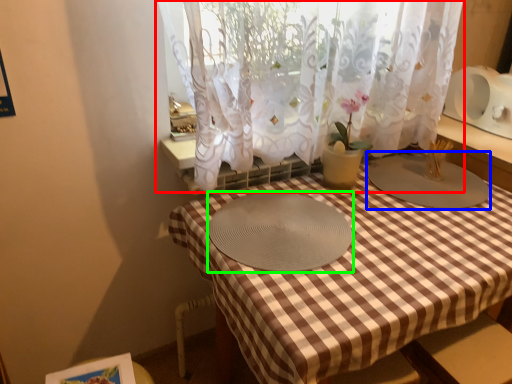
Question: Considering the real-world distances, which object is farthest from curtain (highlighted by a red box)? glass plate (highlighted by a blue box) or glass plate (highlighted by a green box)?

Choices:
 (A) glass plate
 (B) glass plate

Answer: (A)